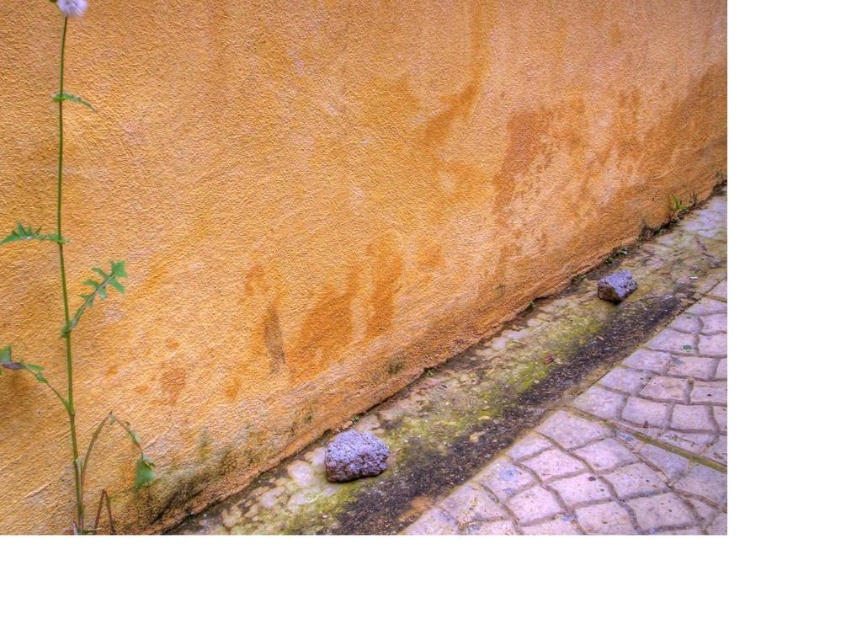
Does point (625, 509) come closer to viewer compared to point (72, 0)?

No, it is behind (72, 0).

Is brown stone pavement at lower right bigger than white fluffy flower at upper left?

Indeed, brown stone pavement at lower right has a larger size compared to white fluffy flower at upper left.

Is point (509, 518) behind point (69, 10)?

Yes, it is behind point (69, 10).

Find the location of a particular element. brown stone pavement at lower right is located at coordinates (616, 445).

What do you see at coordinates (354, 456) in the screenshot?
I see `gray rough stone at center` at bounding box center [354, 456].

Which is behind, point (342, 481) or point (69, 6)?

Positioned behind is point (342, 481).

Which is behind, point (380, 468) or point (67, 3)?

The point (380, 468) is behind.

Where is `gray rough stone at center`? The height and width of the screenshot is (640, 862). gray rough stone at center is located at coordinates (354, 456).

Who is taller, green leafy stem at left or gray rough rock at lower right?

Standing taller between the two is green leafy stem at left.

I want to click on green leafy stem at left, so click(x=73, y=330).

Where is `green leafy stem at left`? The height and width of the screenshot is (640, 862). green leafy stem at left is located at coordinates (73, 330).